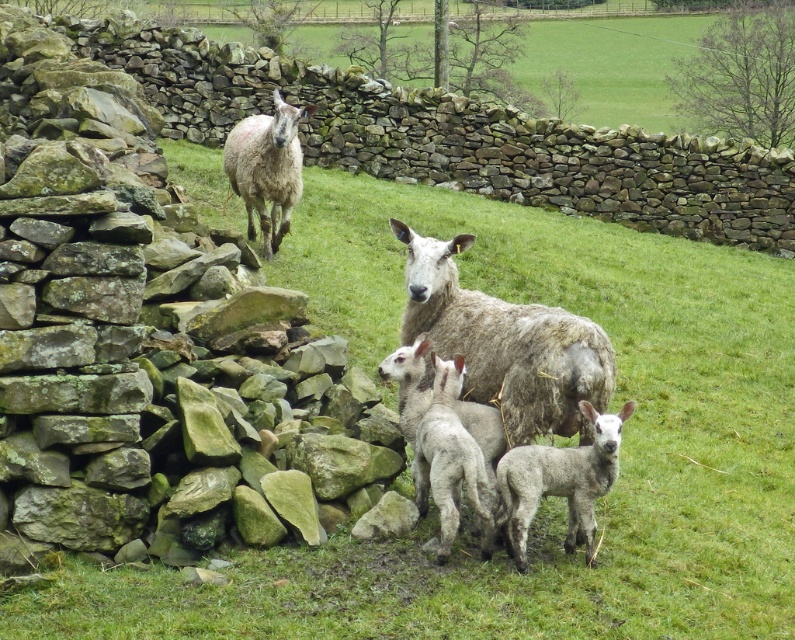
Who is higher up, gray woolen sheep at center or fuzzy white lamb at center?

Positioned higher is gray woolen sheep at center.

Is point (607, 365) closer to camera compared to point (588, 528)?

Yes, point (607, 365) is closer to viewer.

This screenshot has width=795, height=640. I want to click on gray woolen sheep at center, so click(x=506, y=344).

You are a GUI agent. You are given a task and a screenshot of the screen. Output one action in this format:
    pyautogui.click(x=<x>, y=<y>)
    Task: Click on the gray woolen sheep at center
    This screenshot has width=795, height=640.
    Given the screenshot: What is the action you would take?
    pyautogui.click(x=506, y=344)

Between gray woolen sheep at center and gray woolen lamb at center, which one is positioned higher?

gray woolen sheep at center

I want to click on gray woolen sheep at center, so click(506, 344).

Where is `gray woolen sheep at center`? The width and height of the screenshot is (795, 640). gray woolen sheep at center is located at coordinates (506, 344).

Is gray woolen sheep at center to the left of fuzzy white sheep at upper left from the viewer's perspective?

In fact, gray woolen sheep at center is to the right of fuzzy white sheep at upper left.

Between gray woolen sheep at center and fuzzy white sheep at upper left, which one is positioned higher?

Positioned higher is fuzzy white sheep at upper left.

Based on the photo, who is more forward, (557, 333) or (251, 134)?

Point (557, 333) is more forward.

The height and width of the screenshot is (640, 795). In order to click on gray woolen sheep at center in this screenshot , I will do `click(506, 344)`.